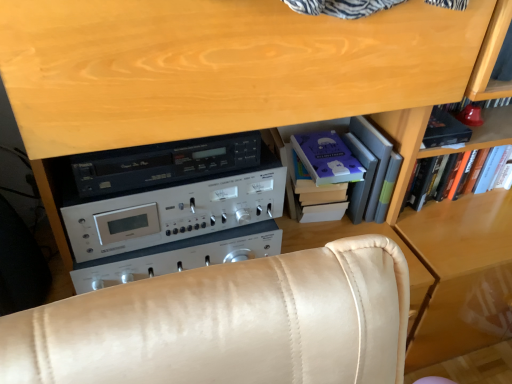
Question: Is hardcover books at center, arranged as the 1th shelf when viewed from the left, not within hardcover book at upper right?

Choices:
 (A) no
 (B) yes

Answer: (B)

Question: Is the position of hardcover books at center, arranged as the 1th shelf when viewed from the left, less distant than that of hardcover book at upper right?

Choices:
 (A) yes
 (B) no

Answer: (A)

Question: Is the surface of hardcover books at center, arranged as the 1th shelf when viewed from the left, in direct contact with hardcover book at upper right?

Choices:
 (A) yes
 (B) no

Answer: (B)

Question: Considering the relative sizes of hardcover books at center, arranged as the 1th shelf when viewed from the left, and hardcover book at upper right in the image provided, is hardcover books at center, arranged as the 1th shelf when viewed from the left, taller than hardcover book at upper right?

Choices:
 (A) no
 (B) yes

Answer: (B)

Question: Is hardcover books at center, which is counted as the second shelf, starting from the right, oriented away from hardcover book at upper right?

Choices:
 (A) yes
 (B) no

Answer: (B)

Question: From the image's perspective, is hardcover books at center, arranged as the 1th shelf when viewed from the left, over hardcover book at upper right?

Choices:
 (A) yes
 (B) no

Answer: (A)

Question: Can you confirm if wooden bookshelf at right, which is counted as the 1th shelf, starting from the right, is positioned to the left of hardcover book at upper right?

Choices:
 (A) no
 (B) yes

Answer: (A)

Question: Can you confirm if wooden bookshelf at right, the 2th shelf positioned from the left, is thinner than hardcover book at upper right?

Choices:
 (A) yes
 (B) no

Answer: (B)

Question: Is wooden bookshelf at right, the 2th shelf positioned from the left, surrounding hardcover book at upper right?

Choices:
 (A) yes
 (B) no

Answer: (A)

Question: Is wooden bookshelf at right, the 2th shelf positioned from the left, positioned behind hardcover book at upper right?

Choices:
 (A) yes
 (B) no

Answer: (B)

Question: Does wooden bookshelf at right, the 2th shelf positioned from the left, have a smaller size compared to hardcover book at upper right?

Choices:
 (A) no
 (B) yes

Answer: (A)

Question: Is wooden bookshelf at right, which is counted as the 1th shelf, starting from the right, facing towards hardcover book at upper right?

Choices:
 (A) no
 (B) yes

Answer: (B)

Question: Is hardcover book at upper right at the left side of purple matte paper at center, the second paperback book in the right-to-left sequence?

Choices:
 (A) no
 (B) yes

Answer: (A)